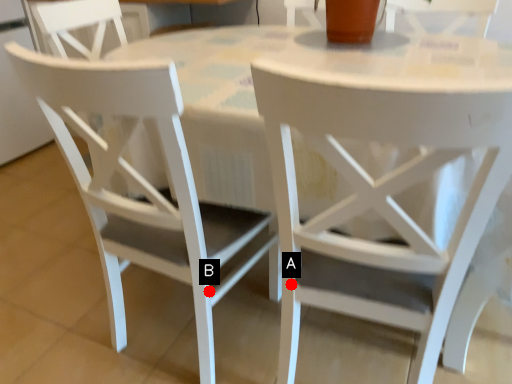
Question: Two points are circled on the image, labeled by A and B beside each circle. Among these points, which one is nearest to the camera?

Choices:
 (A) A is closer
 (B) B is closer

Answer: (A)